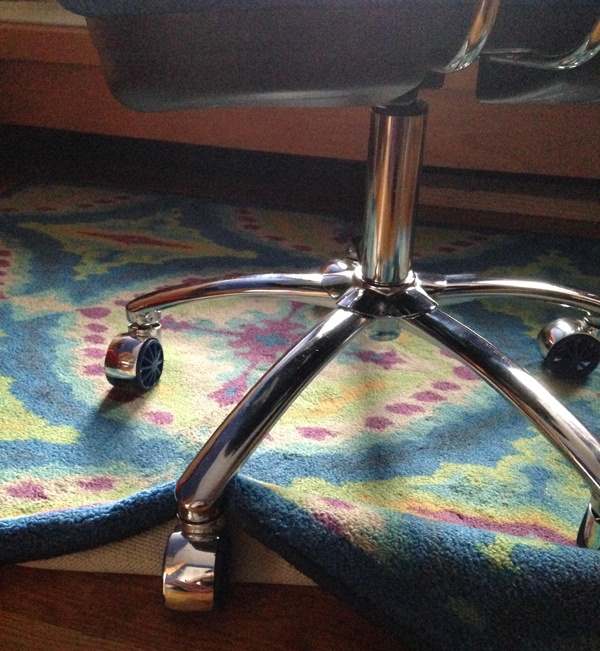
Image resolution: width=600 pixels, height=651 pixels. In order to click on under rug in this screenshot , I will do `click(106, 562)`.